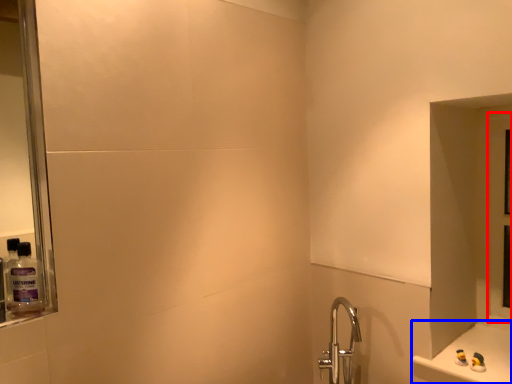
Question: Which point is further to the camera, glass door (highlighted by a red box) or counter (highlighted by a blue box)?

Choices:
 (A) glass door
 (B) counter

Answer: (A)